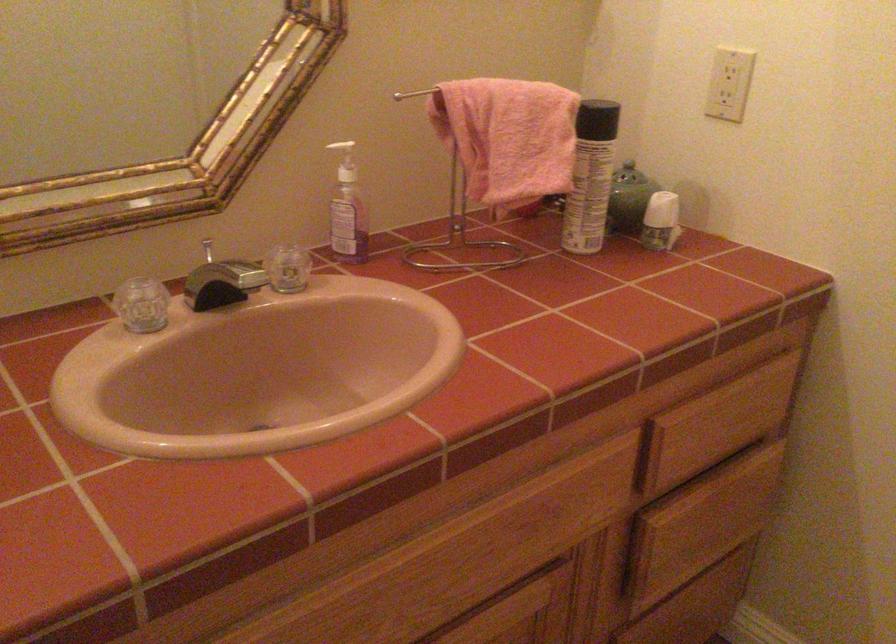
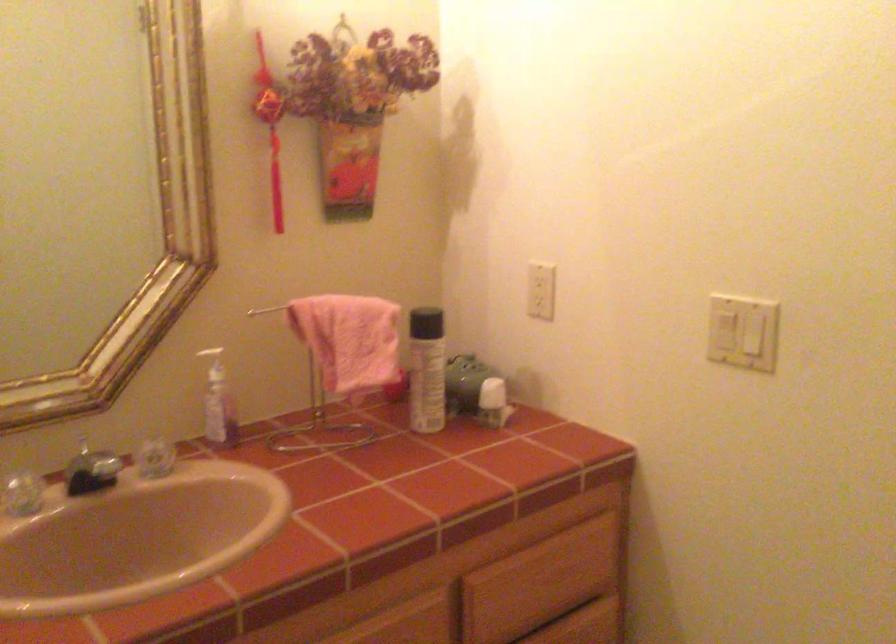
Question: How did the camera likely rotate?

Choices:
 (A) Left
 (B) Right
 (C) Up
 (D) Down

Answer: (C)